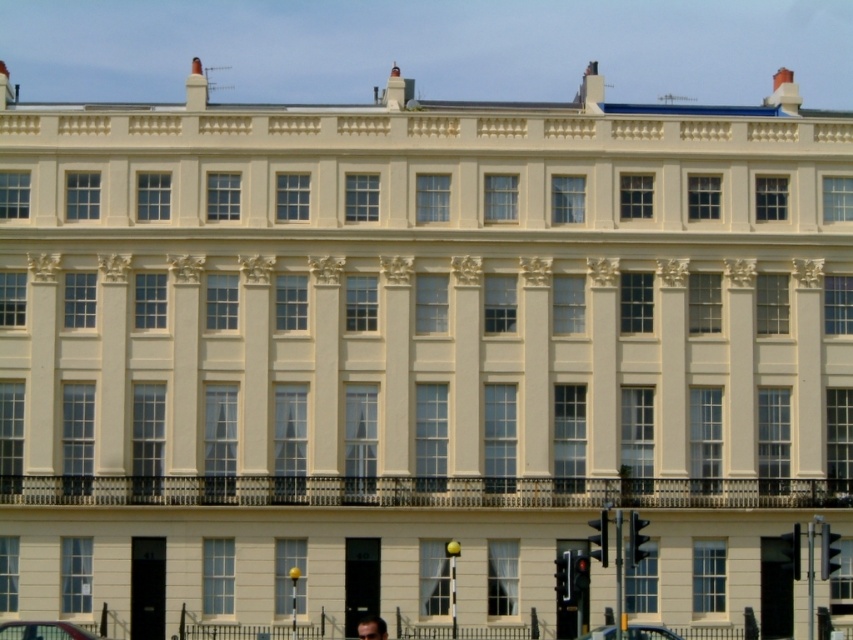
Question: Can you confirm if metallic silver car at center is positioned to the left of dark brown hair at lower center?

Choices:
 (A) no
 (B) yes

Answer: (A)

Question: Is metallic silver car at lower center positioned at the back of dark brown hair at lower center?

Choices:
 (A) no
 (B) yes

Answer: (B)

Question: Which of these objects is positioned farthest from the metallic silver car at center?

Choices:
 (A) metallic silver car at lower center
 (B) dark brown hair at lower center

Answer: (A)

Question: Is metallic silver car at center wider than dark brown hair at lower center?

Choices:
 (A) no
 (B) yes

Answer: (A)

Question: Estimate the real-world distances between objects in this image. Which object is farther from the metallic silver car at lower center?

Choices:
 (A) dark brown hair at lower center
 (B) metallic silver car at center

Answer: (B)

Question: Which point is closer to the camera?

Choices:
 (A) metallic silver car at lower center
 (B) dark brown hair at lower center

Answer: (B)